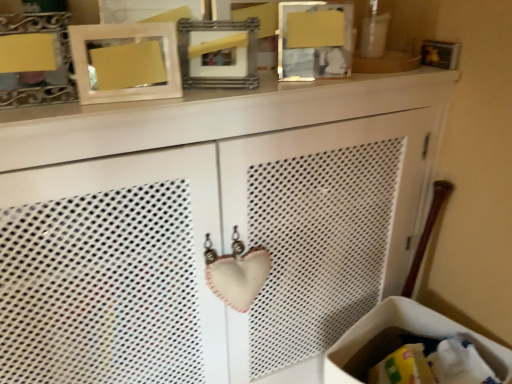
Find the location of a particular element. This screenshot has height=384, width=512. vacant area located to the right-hand side of matte silver picture frame at upper left, acting as the 4th picture frame starting from the right is located at coordinates (89, 99).